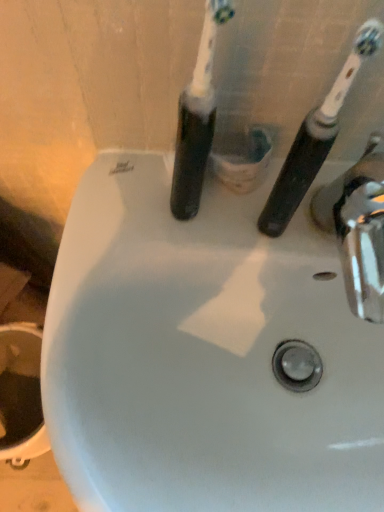
Question: From their relative heights in the image, would you say black rubber toothbrush at upper right, which is the 2th toothbrush in left-to-right order, is taller or shorter than black plastic toothbrush at center, placed as the first toothbrush when sorted from left to right?

Choices:
 (A) tall
 (B) short

Answer: (B)

Question: From a real-world perspective, is black rubber toothbrush at upper right, which appears as the first toothbrush when viewed from the right, above or below black plastic toothbrush at center, arranged as the 2th toothbrush when viewed from the right?

Choices:
 (A) below
 (B) above

Answer: (A)

Question: Considering the real-world distances, which object is closest to the chrome metallic tap at right?

Choices:
 (A) black plastic toothbrush at center, placed as the first toothbrush when sorted from left to right
 (B) black rubber toothbrush at upper right, which appears as the first toothbrush when viewed from the right

Answer: (B)

Question: Estimate the real-world distances between objects in this image. Which object is farther from the chrome metallic tap at right?

Choices:
 (A) black rubber toothbrush at upper right, which appears as the first toothbrush when viewed from the right
 (B) black plastic toothbrush at center, placed as the first toothbrush when sorted from left to right

Answer: (B)